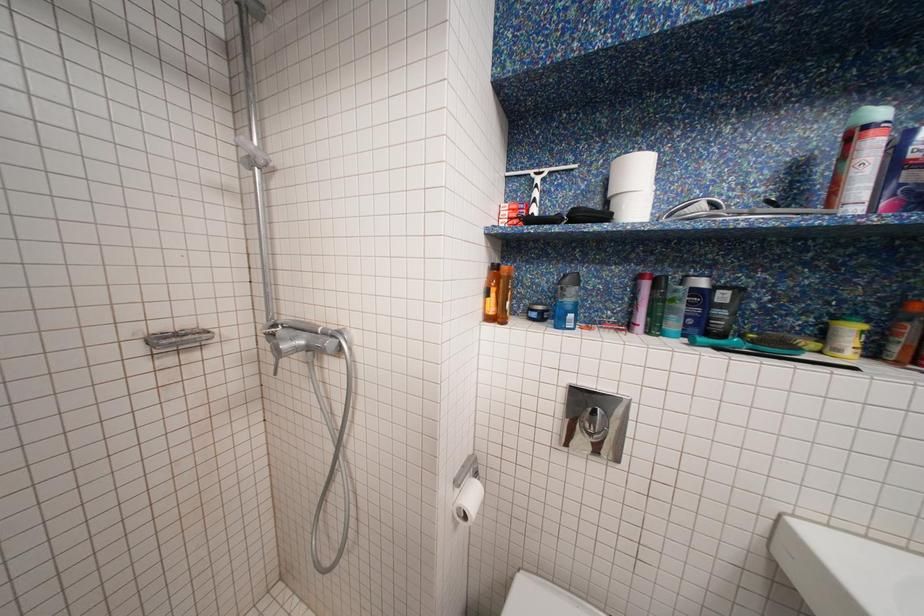
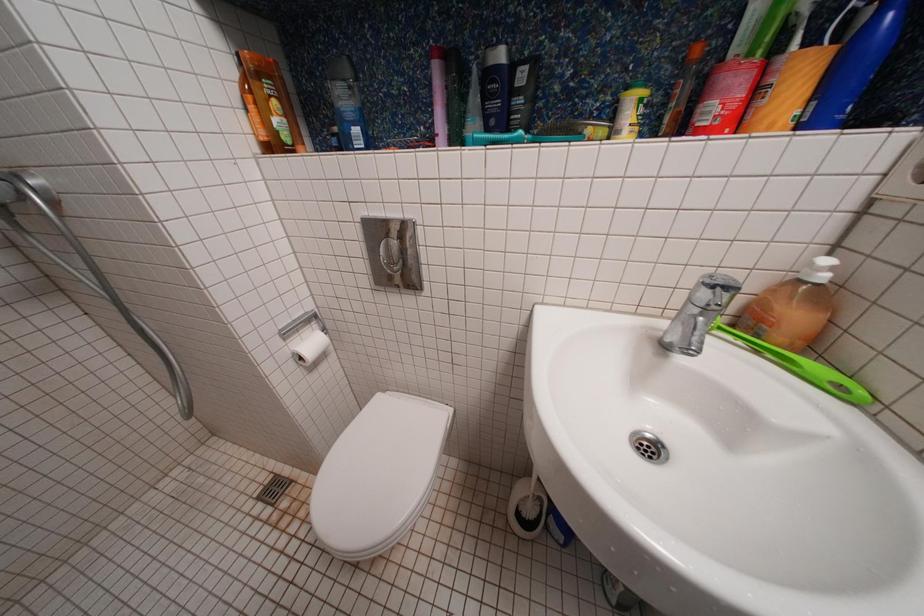
Question: Based on the continuous images, in which direction is the camera rotating? Reply with the corresponding letter.

Choices:
 (A) Left
 (B) Right
 (C) Up
 (D) Down

Answer: (D)